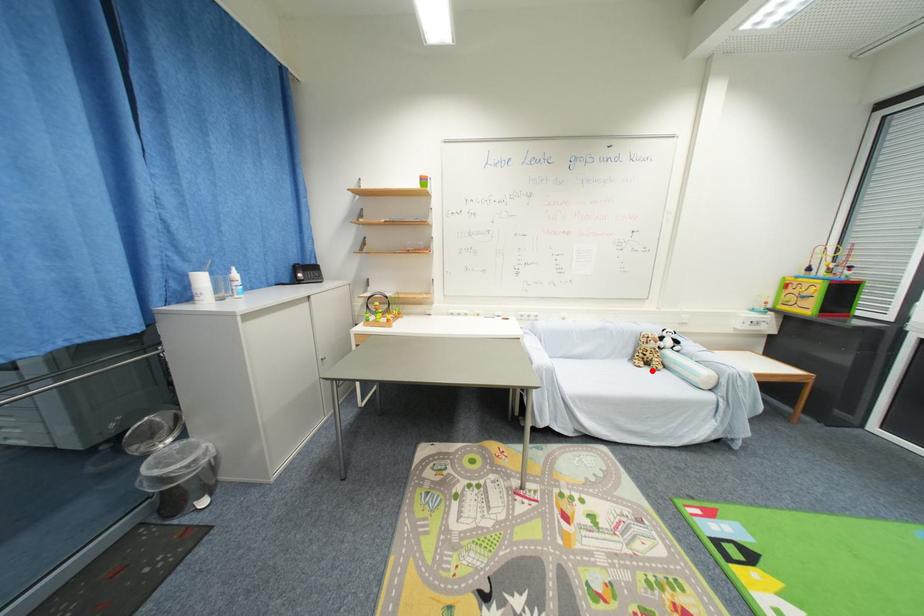
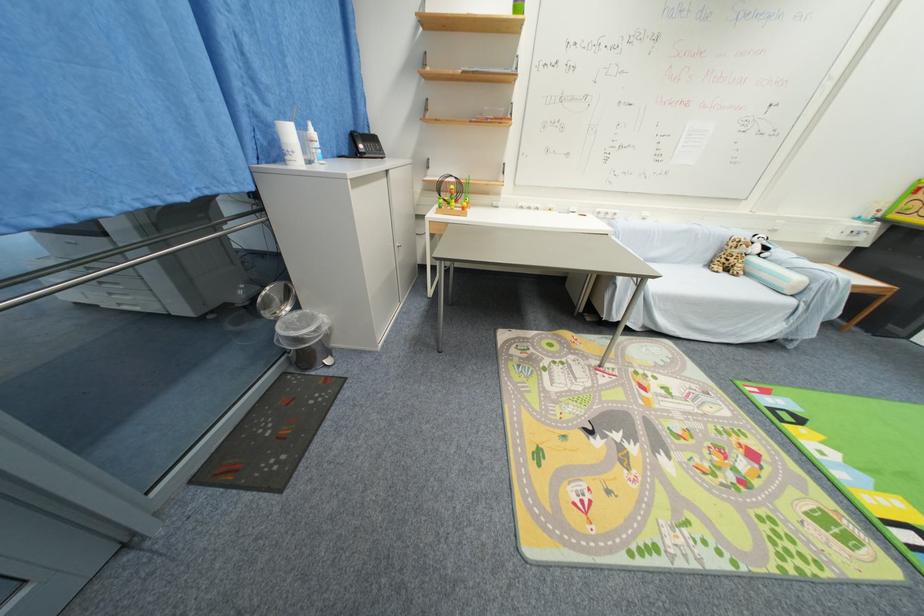
Find the pixel in the second image that matches the highlighted location in the first image.

(730, 276)